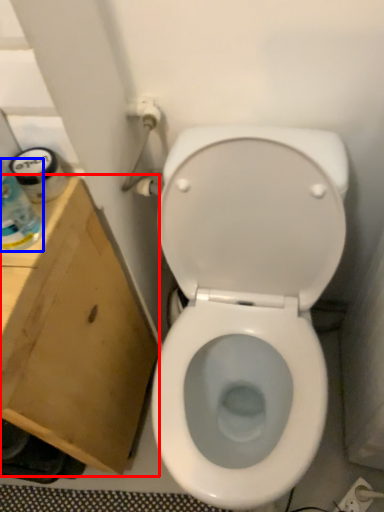
Question: Which object is further to the camera taking this photo, cardboard box (highlighted by a red box) or bottle (highlighted by a blue box)?

Choices:
 (A) cardboard box
 (B) bottle

Answer: (A)